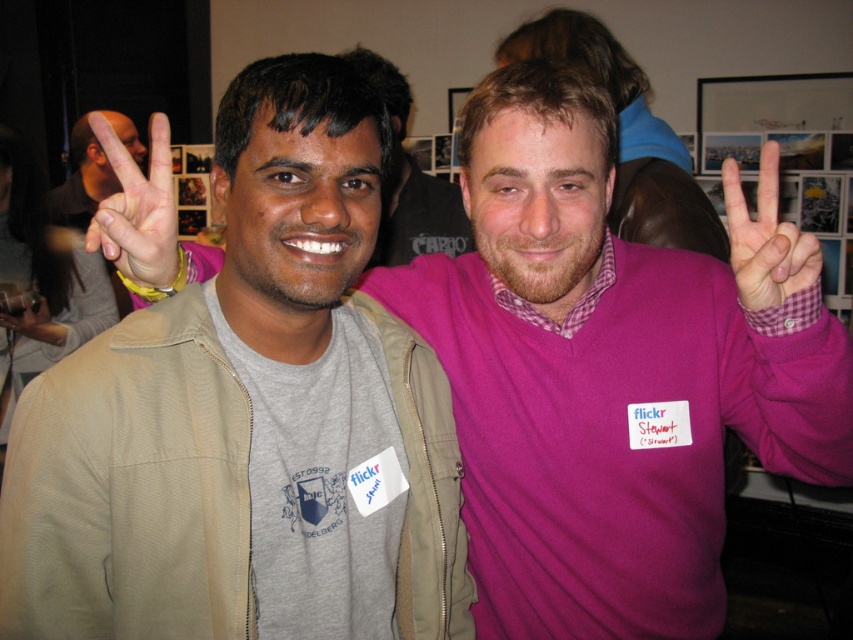
Who is positioned more to the right, pink matte sweater at center or matte black hand at center?

pink matte sweater at center

Which of these two, pink matte sweater at center or matte black hand at center, stands taller?

pink matte sweater at center is taller.

Between point (390, 195) and point (27, 317), which one is positioned in front?

Positioned in front is point (27, 317).

Find the location of a particular element. pink matte sweater at center is located at coordinates (409, 180).

Who is shorter, matte skin hand at center or matte black hand at upper left?

matte skin hand at center

Is matte skin hand at center below matte black hand at upper left?

Correct, matte skin hand at center is located below matte black hand at upper left.

Where is `matte skin hand at center`? Image resolution: width=853 pixels, height=640 pixels. matte skin hand at center is located at coordinates (136, 205).

The width and height of the screenshot is (853, 640). What are the coordinates of `matte skin hand at center` in the screenshot? It's located at (136, 205).

Is point (107, 259) more distant than point (10, 326)?

No, it is not.

Between matte skin hand at center and matte black hand at center, which one appears on the left side from the viewer's perspective?

Positioned to the left is matte black hand at center.

Between point (155, 168) and point (38, 330), which one is positioned behind?

Positioned behind is point (38, 330).

Where is `matte skin hand at center`? matte skin hand at center is located at coordinates (136, 205).